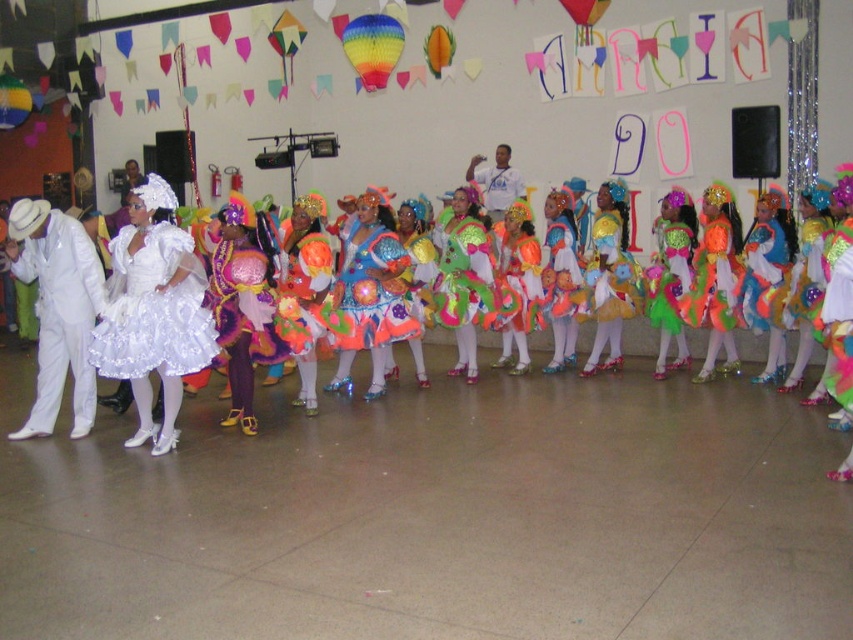
Is shiny multicolored dress at center positioned before rainbow paper balloon at upper left?

Yes, it is in front of rainbow paper balloon at upper left.

Is shiny multicolored dress at center bigger than rainbow paper balloon at upper left?

Yes, shiny multicolored dress at center is bigger than rainbow paper balloon at upper left.

The image size is (853, 640). In order to click on shiny multicolored dress at center in this screenshot , I will do `click(838, 316)`.

The image size is (853, 640). Find the location of `shiny multicolored dress at center`. shiny multicolored dress at center is located at coordinates (838, 316).

Is white satin dress at center above shiny multicolored dress at center?

Correct, white satin dress at center is located above shiny multicolored dress at center.

Measure the distance between white satin dress at center and camera.

They are 16.53 feet apart.

Is point (21, 225) positioned behind point (833, 316)?

Yes, point (21, 225) is behind point (833, 316).

This screenshot has width=853, height=640. Identify the location of white satin dress at center. (25, 216).

Between rainbow paper balloon at upper center and rainbow paper balloon at upper left, which one has more height?

Standing taller between the two is rainbow paper balloon at upper left.

Does rainbow paper balloon at upper center appear under rainbow paper balloon at upper left?

Yes.

Does point (361, 33) come in front of point (9, 106)?

Yes, point (361, 33) is closer to viewer.

Where is `rainbow paper balloon at upper center`? The width and height of the screenshot is (853, 640). rainbow paper balloon at upper center is located at coordinates tap(372, 48).